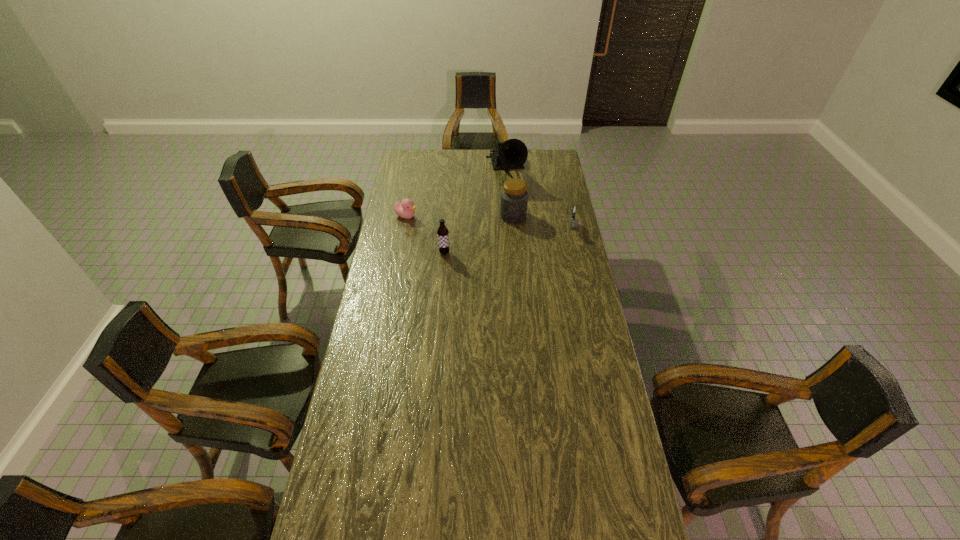
This screenshot has width=960, height=540. I want to click on free region located 0.130m on the front-facing side of the leftmost object, so click(x=441, y=225).

Identify the location of vacant space located on the front-facing side of the leftmost object. coord(426,220).

At what (x,y) coordinates should I click in order to perform the action: click on free space located on the front-facing side of the leftmost object. Please return your answer as a coordinate pair (x, y). The height and width of the screenshot is (540, 960). Looking at the image, I should click on (458, 229).

At what (x,y) coordinates should I click in order to perform the action: click on vacant space positioned 0.180m from the horn of the phonograph_record. Please return your answer as a coordinate pair (x, y). Looking at the image, I should click on point(515,211).

Locate an element on the screen. vacant area located 0.060m from the horn of the phonograph_record is located at coordinates (511, 197).

Find the location of a particular element. The width and height of the screenshot is (960, 540). blank space located from the horn of the phonograph_record is located at coordinates (512, 200).

In order to click on free space located on the surface of the jar near the warning symbol in this screenshot , I will do `click(505, 233)`.

You are a GUI agent. You are given a task and a screenshot of the screen. Output one action in this format:
    pyautogui.click(x=<x>, y=<y>)
    Task: Click on the vacant space situated on the surface of the jar near the warning symbol
    Image resolution: width=960 pixels, height=540 pixels.
    Given the screenshot: What is the action you would take?
    pyautogui.click(x=497, y=249)

Locate an element on the screen. The image size is (960, 540). blank space located on the surface of the jar near the warning symbol is located at coordinates (506, 232).

I want to click on object positioned at the far edge, so click(x=512, y=154).